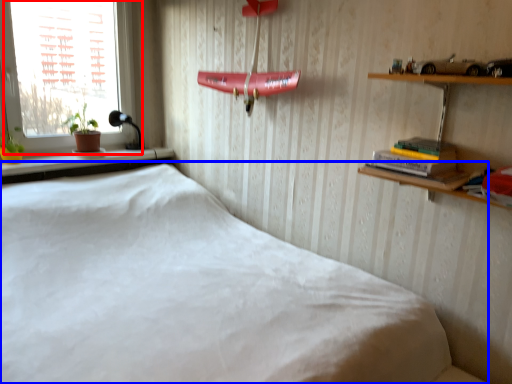
Question: Among these objects, which one is nearest to the camera, window (highlighted by a red box) or bed (highlighted by a blue box)?

Choices:
 (A) window
 (B) bed

Answer: (B)